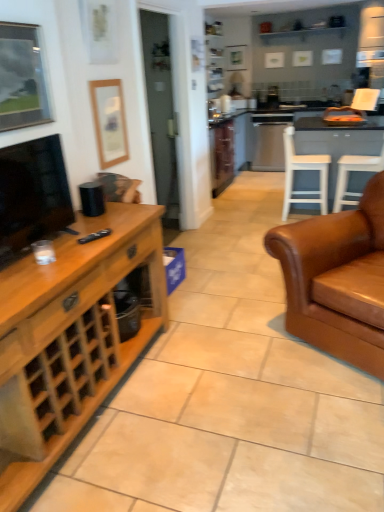
Where is `matte black tv at left`? matte black tv at left is located at coordinates (32, 195).

Describe the element at coordinates (22, 78) in the screenshot. I see `metallic silver picture frame at upper left, which appears as the first picture frame when viewed from the left` at that location.

You are a GUI agent. You are given a task and a screenshot of the screen. Output one action in this format:
    pyautogui.click(x=<x>, y=<y>)
    Task: Click on the white wood table at right
    The width and height of the screenshot is (384, 512).
    Given the screenshot: What is the action you would take?
    pyautogui.click(x=337, y=143)

This screenshot has width=384, height=512. I want to click on matte black tv at left, so click(x=32, y=195).

Between white wood chair at center, positioned as the 1th chair in left-to-right order, and matte black tv at left, which one appears on the right side from the viewer's perspective?

From the viewer's perspective, white wood chair at center, positioned as the 1th chair in left-to-right order, appears more on the right side.

From the image's perspective, is white wood chair at center, positioned as the 1th chair in left-to-right order, beneath matte black tv at left?

Actually, white wood chair at center, positioned as the 1th chair in left-to-right order, appears above matte black tv at left in the image.

Can you tell me how much white wood chair at center, positioned as the 1th chair in left-to-right order, and matte black tv at left differ in facing direction?

3.03 degrees.

From a real-world perspective, is white wood chair at center, the 2th chair from the right, positioned over matte black tv at left based on gravity?

No, from a real-world perspective, white wood chair at center, the 2th chair from the right, is not over matte black tv at left

Is white wood table at right oriented towards metallic silver picture frame at upper left, arranged as the 1th picture frame when viewed from the front?

Yes, white wood table at right is oriented towards metallic silver picture frame at upper left, arranged as the 1th picture frame when viewed from the front.

Is white wood table at right in contact with metallic silver picture frame at upper left, which appears as the first picture frame when viewed from the left?

They are not placed beside each other.

What's the angular difference between white wood table at right and metallic silver picture frame at upper left, which appears as the first picture frame when viewed from the left,'s facing directions?

88 degrees separate the facing orientations of white wood table at right and metallic silver picture frame at upper left, which appears as the first picture frame when viewed from the left.

From the image's perspective, which one is positioned lower, white wood table at right or metallic silver picture frame at upper left, which ranks as the second picture frame in right-to-left order?

metallic silver picture frame at upper left, which ranks as the second picture frame in right-to-left order, is shown below in the image.

Is point (47, 153) positioned behind point (350, 200)?

No, (47, 153) is in front of (350, 200).

This screenshot has width=384, height=512. I want to click on television above the white plastic chair at right, the 1th chair in the right-to-left sequence (from a real-world perspective), so click(x=32, y=195).

Can you tell me how much matte black tv at left and white plastic chair at right, the 1th chair in the right-to-left sequence, differ in facing direction?

The angle between the facing direction of matte black tv at left and the facing direction of white plastic chair at right, the 1th chair in the right-to-left sequence, is 179 degrees.

From a real-world perspective, between matte black tv at left and white plastic chair at right, the 1th chair in the right-to-left sequence, who is vertically higher?

matte black tv at left.

From a real-world perspective, which is physically above, metallic silver picture frame at upper left, which appears as the first picture frame when viewed from the left, or wooden cabinet at left?

In real-world perspective, metallic silver picture frame at upper left, which appears as the first picture frame when viewed from the left, is above.

Is metallic silver picture frame at upper left, which is the second picture frame from back to front, directly adjacent to wooden cabinet at left?

No.

The height and width of the screenshot is (512, 384). In order to click on picture frame on the left side of wooden cabinet at left in this screenshot , I will do `click(22, 78)`.

Looking at this image, can you confirm if metallic silver picture frame at upper left, arranged as the 1th picture frame when viewed from the front, is wider than wooden cabinet at left?

No.

Is white wood chair at center, the 2th chair from the right, oriented towards white plastic chair at right, which is the second chair from left to right?

Yes, white wood chair at center, the 2th chair from the right, is facing white plastic chair at right, which is the second chair from left to right.

Is white wood chair at center, positioned as the 1th chair in left-to-right order, far away from white plastic chair at right, which is the second chair from left to right?

No, there isn't a large distance between white wood chair at center, positioned as the 1th chair in left-to-right order, and white plastic chair at right, which is the second chair from left to right.

Is point (301, 159) closer or farther from the camera than point (358, 156)?

Point (301, 159) is positioned closer to the camera compared to point (358, 156).

Locate an element on the screen. The height and width of the screenshot is (512, 384). chair lying above the white plastic chair at right, the 1th chair in the right-to-left sequence (from the image's perspective) is located at coordinates (303, 170).

Which object is wider, white plastic chair at right, which is the second chair from left to right, or wooden cabinet at left?

With larger width is wooden cabinet at left.

Is the surface of white plastic chair at right, which is the second chair from left to right, in direct contact with wooden cabinet at left?

No, white plastic chair at right, which is the second chair from left to right, is not making contact with wooden cabinet at left.

Starting from the wooden cabinet at left, which chair is the 2nd one to the right? Please provide its 2D coordinates.

[(351, 170)]

Which object is further away from the camera taking this photo, white plastic chair at right, which is the second chair from left to right, or wooden cabinet at left?

white plastic chair at right, which is the second chair from left to right, is further away from the camera.

From the image's perspective, does white wood chair at center, positioned as the 1th chair in left-to-right order, appear higher than white wood table at right?

No, from the image's perspective, white wood chair at center, positioned as the 1th chair in left-to-right order, is not above white wood table at right.

From a real-world perspective, is white wood chair at center, the 2th chair from the right, positioned over white wood table at right based on gravity?

Yes, from a real-world perspective, white wood chair at center, the 2th chair from the right, is on top of white wood table at right.

Between white wood chair at center, positioned as the 1th chair in left-to-right order, and white wood table at right, which one is positioned behind?

white wood table at right.

Which is more distant, (285, 152) or (310, 182)?

The point (285, 152) is more distant.

The width and height of the screenshot is (384, 512). What are the coordinates of `television that is above the white wood chair at center, positioned as the 1th chair in left-to-right order (from a real-world perspective)` in the screenshot? It's located at (32, 195).

Locate an element on the screen. The height and width of the screenshot is (512, 384). table that appears below the metallic silver picture frame at upper left, which ranks as the second picture frame in right-to-left order (from a real-world perspective) is located at coordinates click(337, 143).

Based on their spatial positions, is brown leather couch at right or wooden picture frame at upper left, which is the first picture frame from right to left, closer to wooden cabinet at left?

wooden picture frame at upper left, which is the first picture frame from right to left, is positioned closer to the anchor wooden cabinet at left.

Estimate the real-world distances between objects in this image. Which object is further from white wood chair at center, positioned as the 1th chair in left-to-right order, wooden picture frame at upper left, which is the first picture frame from right to left, or white plastic chair at right, which is the second chair from left to right?

wooden picture frame at upper left, which is the first picture frame from right to left, is further to white wood chair at center, positioned as the 1th chair in left-to-right order.

Considering their positions, is wooden cabinet at left positioned further to brown leather couch at right than white plastic chair at right, the 1th chair in the right-to-left sequence?

Based on the image, white plastic chair at right, the 1th chair in the right-to-left sequence, appears to be further to brown leather couch at right.

Considering their positions, is metallic silver picture frame at upper left, which appears as the first picture frame when viewed from the left, positioned further to brown leather couch at right than white plastic chair at right, the 1th chair in the right-to-left sequence?

white plastic chair at right, the 1th chair in the right-to-left sequence, is further to brown leather couch at right.

Which object lies nearer to the anchor point brown leather couch at right, metallic silver picture frame at upper left, which ranks as the second picture frame in right-to-left order, or black matte remote at center?

black matte remote at center is positioned closer to the anchor brown leather couch at right.

When comparing their distances from white wood table at right, does matte black tv at left or metallic silver picture frame at upper left, which ranks as the second picture frame in right-to-left order, seem further?

Based on the image, matte black tv at left appears to be further to white wood table at right.

Estimate the real-world distances between objects in this image. Which object is further from white wood table at right, brown leather couch at right or matte black tv at left?

matte black tv at left lies further to white wood table at right than the other object.

Looking at this image, from the image, which object appears to be nearer to wooden picture frame at upper left, marked as the second picture frame in a front-to-back arrangement, brown leather couch at right or white wood chair at center, positioned as the 1th chair in left-to-right order?

brown leather couch at right.

This screenshot has width=384, height=512. I want to click on table located between white wood chair at center, the 2th chair from the right, and white plastic chair at right, which is the second chair from left to right, in the left-right direction, so click(x=337, y=143).

You are a GUI agent. You are given a task and a screenshot of the screen. Output one action in this format:
    pyautogui.click(x=<x>, y=<y>)
    Task: Click on the television located between metallic silver picture frame at upper left, which appears as the first picture frame when viewed from the left, and white plastic chair at right, which is the second chair from left to right, in the left-right direction
    Image resolution: width=384 pixels, height=512 pixels.
    Given the screenshot: What is the action you would take?
    pyautogui.click(x=32, y=195)

This screenshot has height=512, width=384. I want to click on remote between brown leather couch at right and white wood chair at center, the 2th chair from the right, from front to back, so click(x=95, y=236).

Locate an element on the screen. remote located between metallic silver picture frame at upper left, arranged as the 1th picture frame when viewed from the front, and white wood chair at center, the 2th chair from the right, in the depth direction is located at coordinates (95, 236).